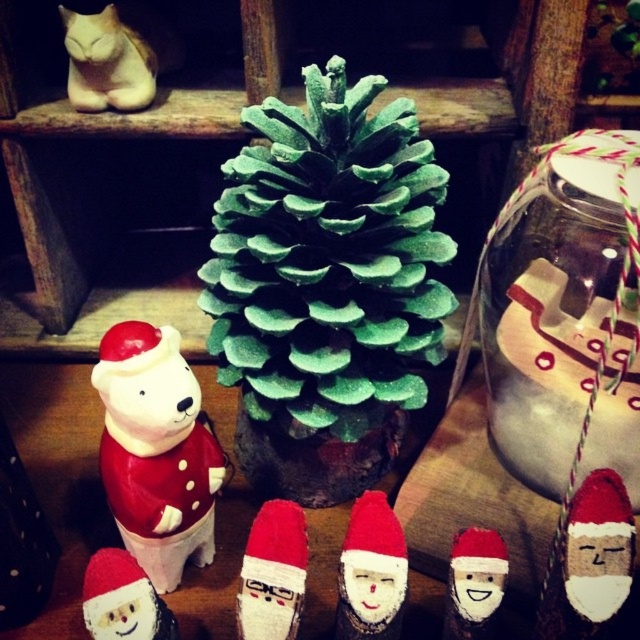
Question: Which point appears farthest from the camera in this image?

Choices:
 (A) (378, 600)
 (B) (307, 184)
 (C) (486, 570)

Answer: (B)

Question: Among these objects, which one is farthest from the camera?

Choices:
 (A) green glittery pinecone at center
 (B) matte wood santa at center
 (C) wooden santa at center

Answer: (C)

Question: Does green glittery pinecone at center appear over matte white bear at center left?

Choices:
 (A) yes
 (B) no

Answer: (A)

Question: Does matte white bear at center left appear on the right side of wooden santa at center?

Choices:
 (A) yes
 (B) no

Answer: (B)

Question: Is green glittery pinecone at center further to camera compared to matte wood santa at center?

Choices:
 (A) yes
 (B) no

Answer: (A)

Question: Considering the real-world distances, which object is closest to the matte white bear at center left?

Choices:
 (A) green glittery pinecone at center
 (B) wooden santa at center

Answer: (A)